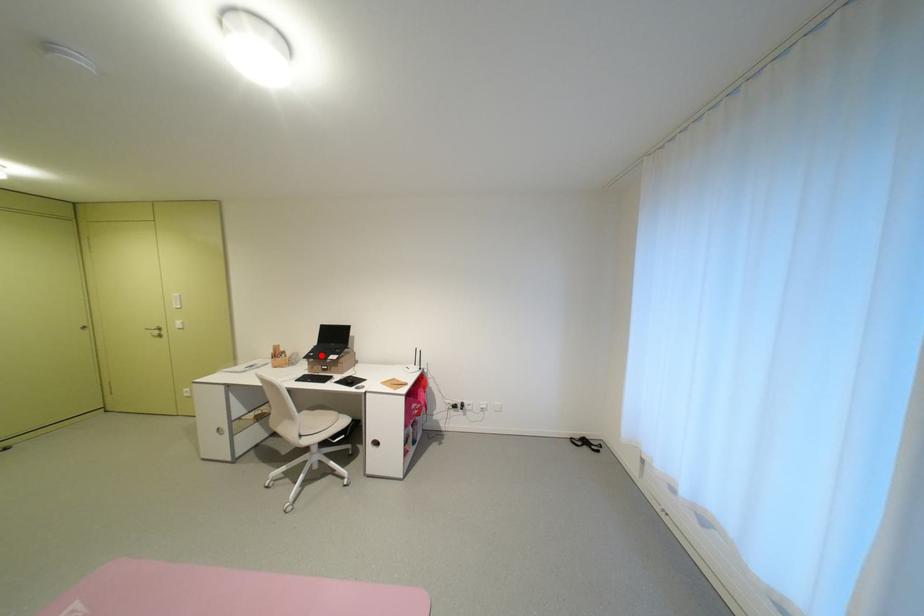
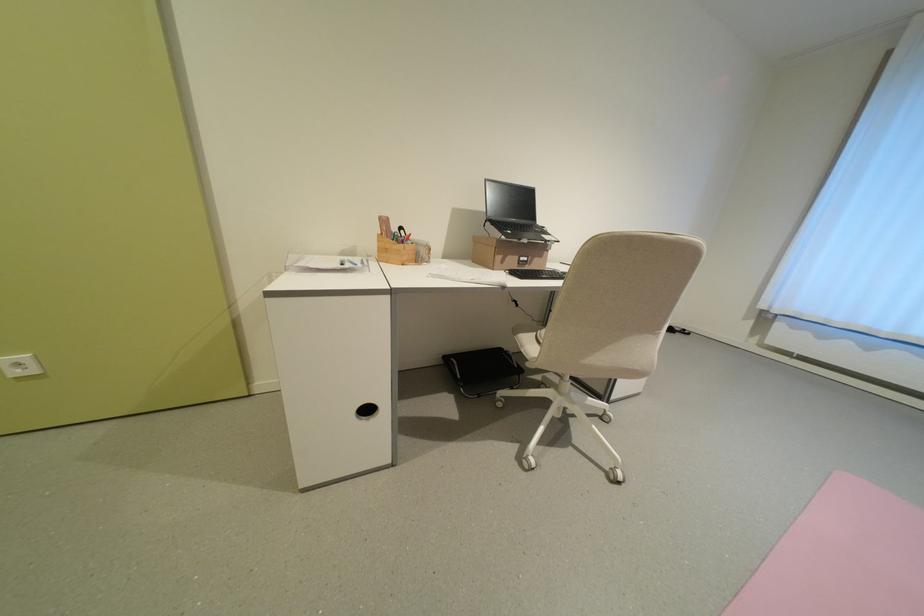
The point at the highlighted location is marked in the first image. Where is the corresponding point in the second image?

(518, 233)